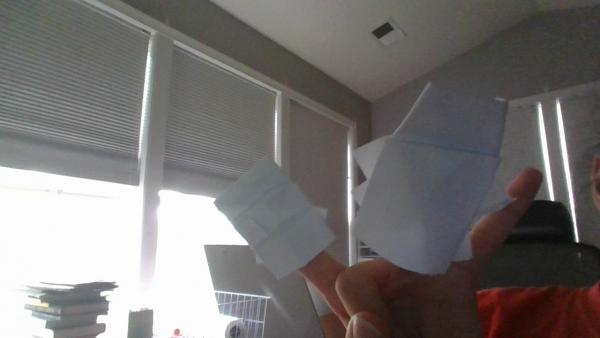
Identify the location of bright light coming in windows. This screenshot has width=600, height=338. (92, 225), (183, 231).